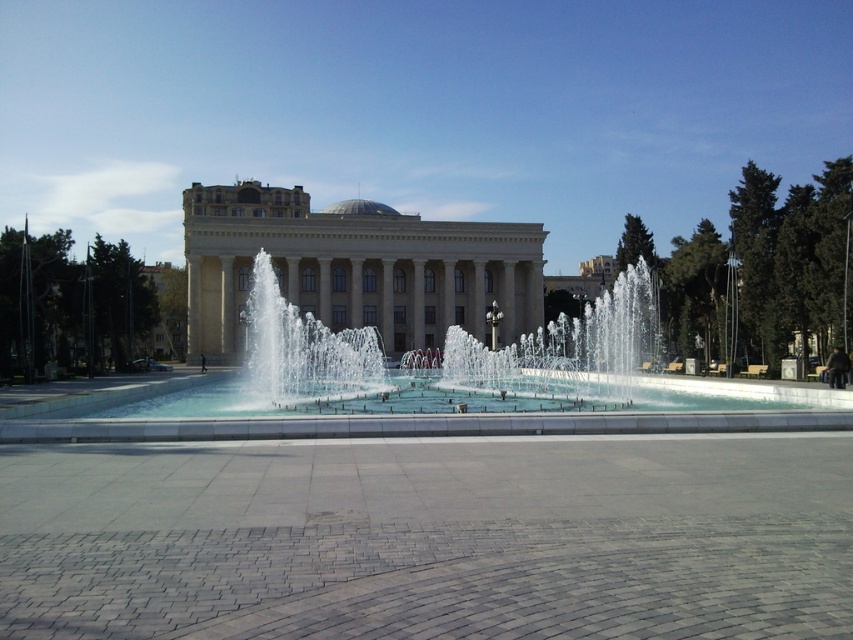
Question: From the image, what is the correct spatial relationship of clear water at center in relation to white marble palace at center?

Choices:
 (A) above
 (B) below

Answer: (B)

Question: Where is clear water at center located in relation to white marble palace at center in the image?

Choices:
 (A) above
 (B) below

Answer: (B)

Question: Can you confirm if clear water at center is thinner than white marble palace at center?

Choices:
 (A) yes
 (B) no

Answer: (A)

Question: Which point is farther from the camera taking this photo?

Choices:
 (A) (444, 310)
 (B) (44, 433)

Answer: (A)

Question: Among these points, which one is farthest from the camera?

Choices:
 (A) (537, 417)
 (B) (228, 278)

Answer: (B)